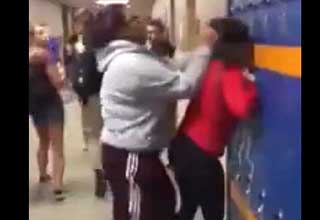
Where is `lockers`? The height and width of the screenshot is (220, 320). lockers is located at coordinates (274, 146).